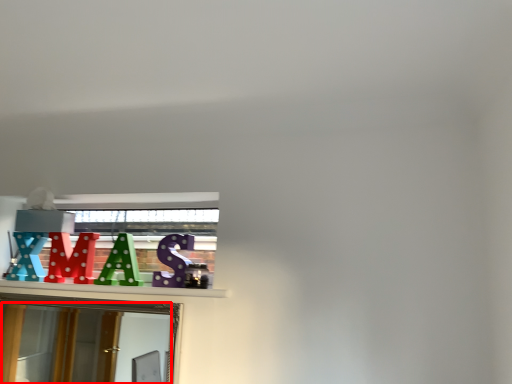
Question: Where is mirror (annotated by the red box) located in relation to alphabet in the image?

Choices:
 (A) left
 (B) right

Answer: (A)